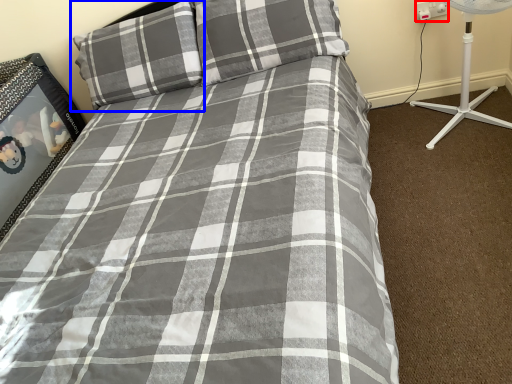
Question: Which of the following is the closest to the observer, electric outlet (highlighted by a red box) or pillow (highlighted by a blue box)?

Choices:
 (A) electric outlet
 (B) pillow

Answer: (B)